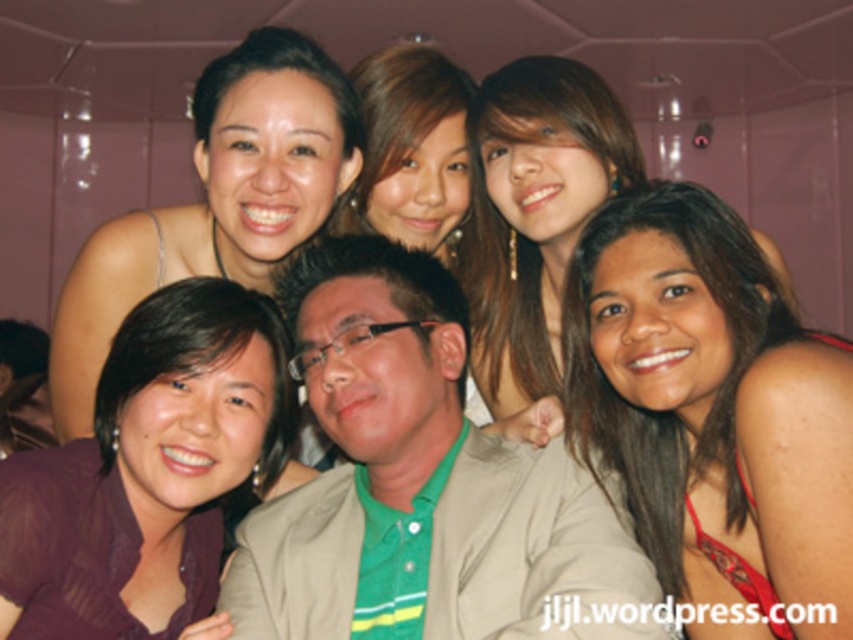
Does brown hair at lower right appear over matte black hair at upper left?

No, brown hair at lower right is not above matte black hair at upper left.

Who is taller, brown hair at lower right or matte black hair at upper left?

Standing taller between the two is brown hair at lower right.

Who is more distant from viewer, (704, 484) or (250, 193)?

Positioned behind is point (704, 484).

This screenshot has width=853, height=640. In order to click on brown hair at lower right in this screenshot , I will do `click(714, 417)`.

The width and height of the screenshot is (853, 640). Describe the element at coordinates (424, 484) in the screenshot. I see `green fabric shirt at center` at that location.

Locate an element on the screen. This screenshot has height=640, width=853. green fabric shirt at center is located at coordinates (424, 484).

Who is positioned more to the left, purple satin blouse at lower left or matte black hair at upper left?

matte black hair at upper left is more to the left.

The height and width of the screenshot is (640, 853). Find the location of `purple satin blouse at lower left`. purple satin blouse at lower left is located at coordinates (149, 468).

Image resolution: width=853 pixels, height=640 pixels. Find the location of `purple satin blouse at lower left`. purple satin blouse at lower left is located at coordinates (149, 468).

Identify the location of purple satin blouse at lower left. (149, 468).